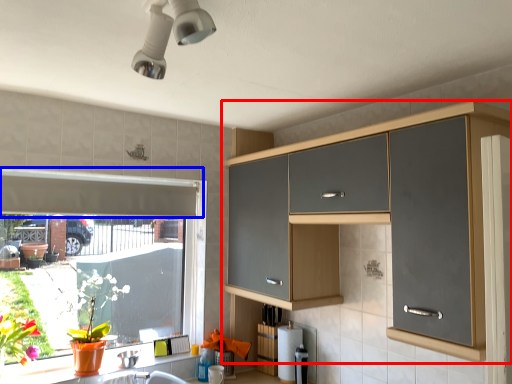
Question: Which object is closer to the camera taking this photo, cabinetry (highlighted by a red box) or exhaust hood (highlighted by a blue box)?

Choices:
 (A) cabinetry
 (B) exhaust hood

Answer: (A)